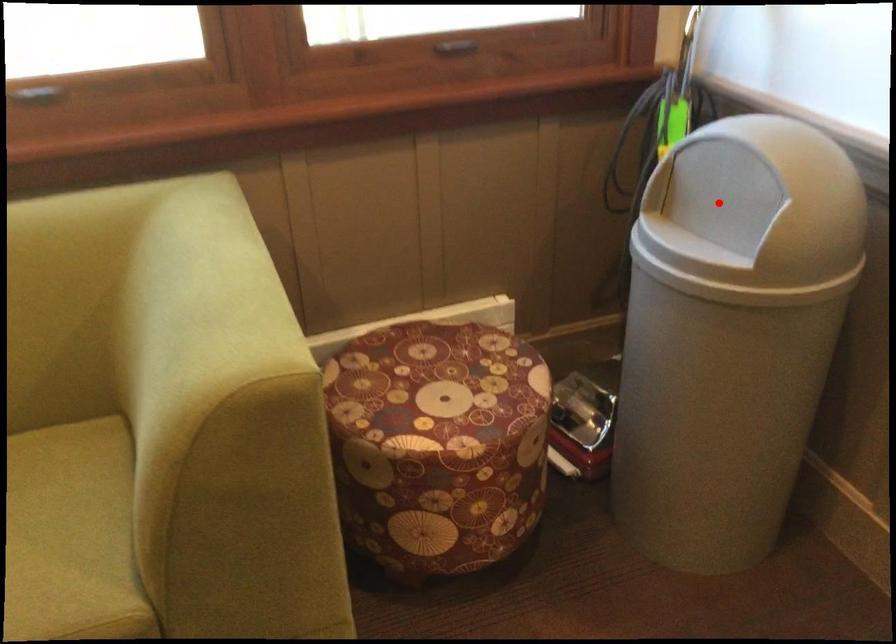
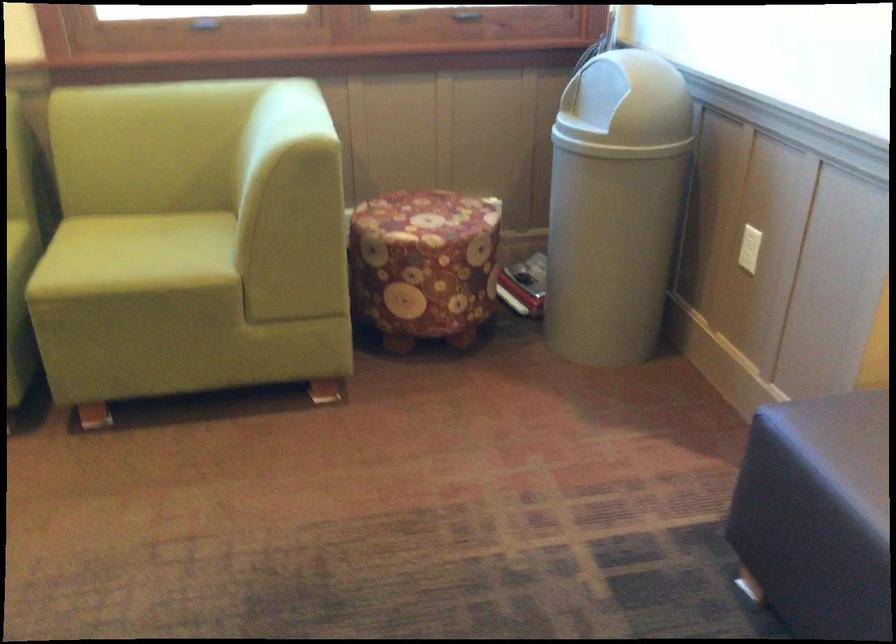
Question: I am providing you with two images of the same scene from different viewpoints. Given a red point in image1, look at the same physical point in image2. Is it:

Choices:
 (A) Closer to the viewpoint
 (B) Farther from the viewpoint

Answer: (B)